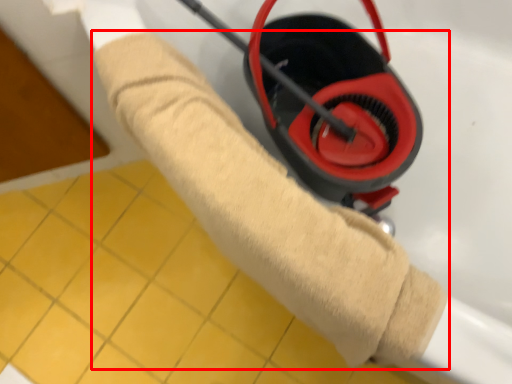
Question: Observing the image, what is the correct spatial positioning of towel (annotated by the red box) in reference to tile?

Choices:
 (A) right
 (B) left

Answer: (A)